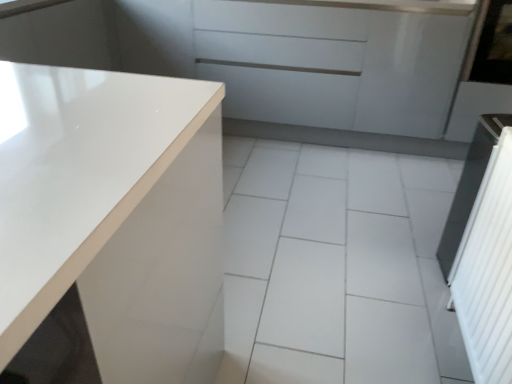
The height and width of the screenshot is (384, 512). I want to click on vacant area on the back side of white textured screen door at right, the first screen door viewed from the left, so click(403, 298).